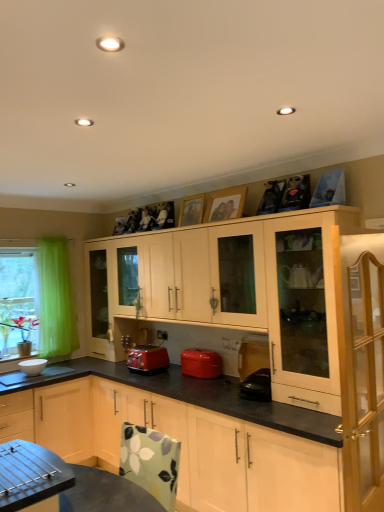
The width and height of the screenshot is (384, 512). Find the location of `vacant area that is in front of matte red toaster at center, placed as the first kitchen appliance when sorted from right to left`. vacant area that is in front of matte red toaster at center, placed as the first kitchen appliance when sorted from right to left is located at coordinates (203, 387).